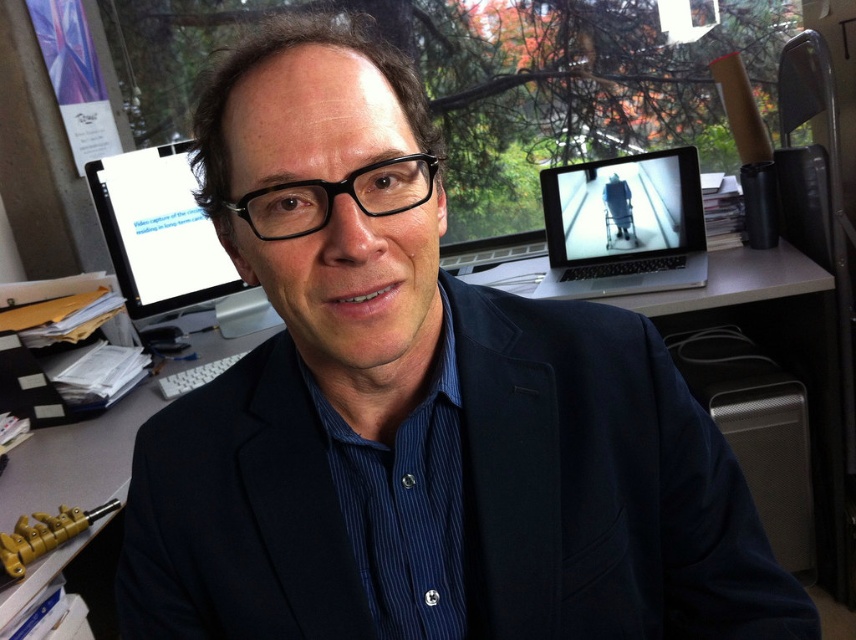
Can you confirm if blue striped dress shirt at center is taller than matte black monitor at upper left?

No, blue striped dress shirt at center is not taller than matte black monitor at upper left.

Between point (382, 461) and point (177, 252), which one is positioned in front?

Positioned in front is point (382, 461).

Measure the distance between point (425, 428) and camera.

Point (425, 428) is 20.78 inches from camera.

I want to click on blue striped dress shirt at center, so click(x=406, y=504).